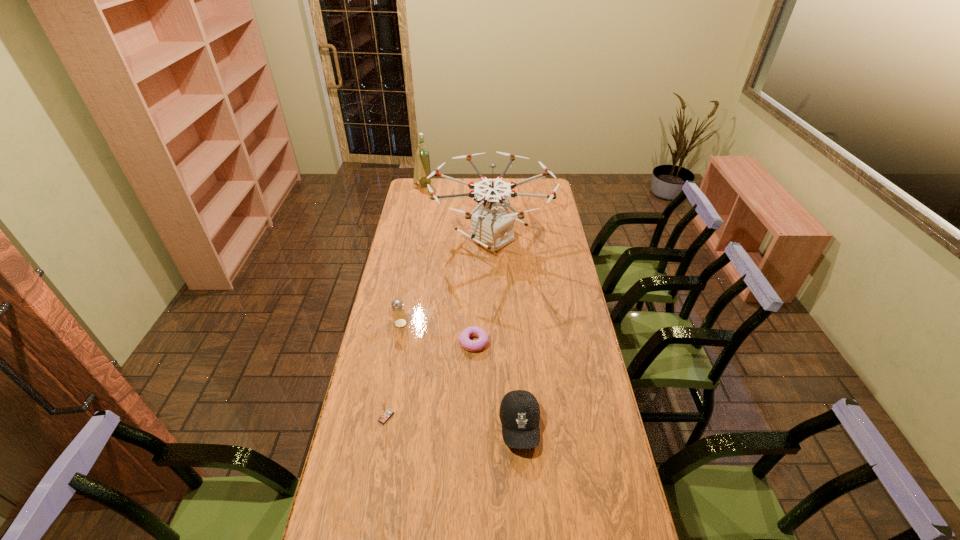
Locate an element on the screen. The width and height of the screenshot is (960, 540). the tallest object is located at coordinates (x=491, y=226).

Where is `drone`? The image size is (960, 540). drone is located at coordinates (491, 226).

At what (x,y) coordinates should I click in order to perform the action: click on the farthest object. Please return your answer as a coordinate pair (x, y). The height and width of the screenshot is (540, 960). Looking at the image, I should click on (422, 169).

Where is `wine bottle`? This screenshot has width=960, height=540. wine bottle is located at coordinates (422, 169).

Where is `saltshaker`? The width and height of the screenshot is (960, 540). saltshaker is located at coordinates (399, 316).

The width and height of the screenshot is (960, 540). In order to click on baseball cap in this screenshot , I will do `click(519, 413)`.

Where is `matchbox`? The width and height of the screenshot is (960, 540). matchbox is located at coordinates (386, 413).

Identify the location of the shortest object. (470, 345).

Where is `doughnut`? doughnut is located at coordinates (470, 345).

Where is `blank space located on the front of the tallest object`? blank space located on the front of the tallest object is located at coordinates (494, 336).